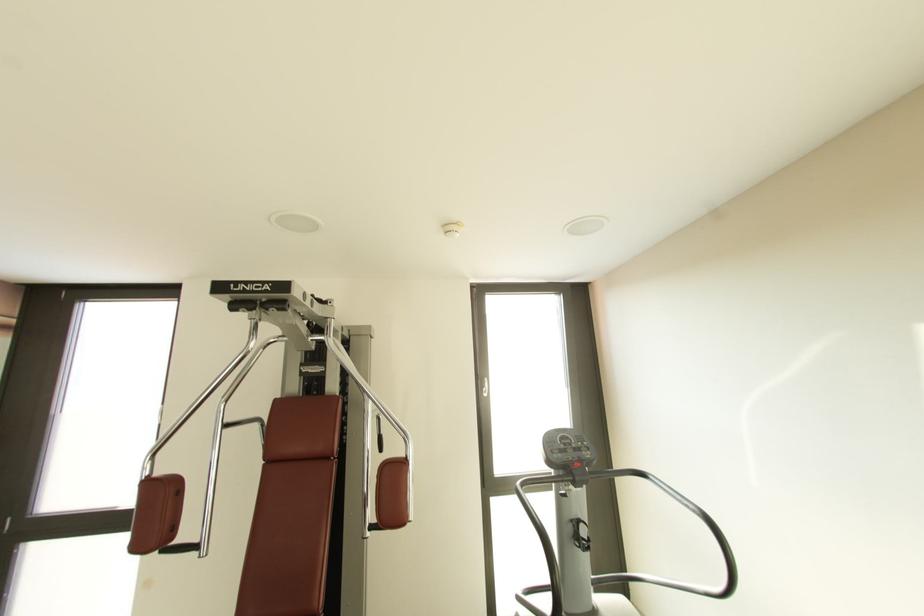
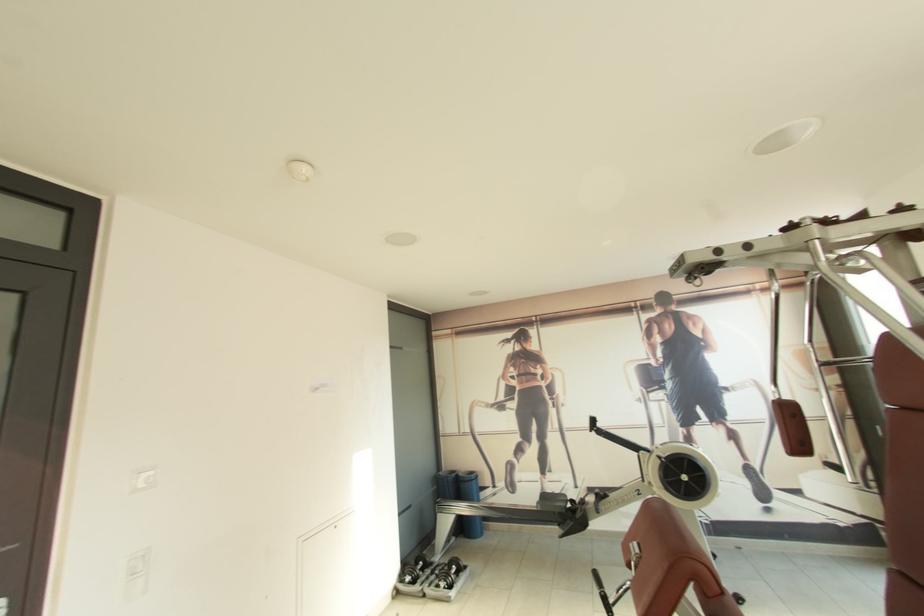
The point at (154, 477) is marked in the first image. Where is the corresponding point in the second image?

(784, 400)